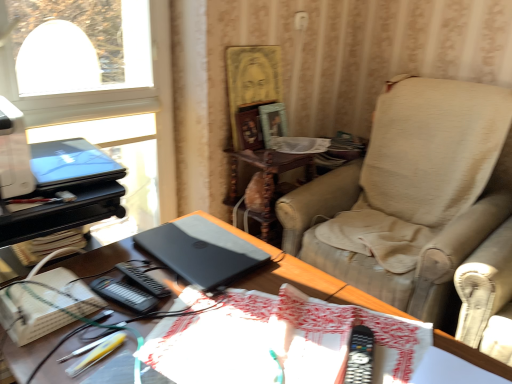
The height and width of the screenshot is (384, 512). I want to click on unoccupied space behind black plastic remote control at lower right, so click(x=337, y=316).